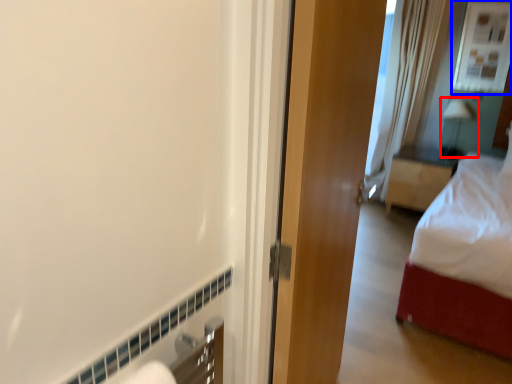
Question: Which of the following is the farthest to the observer, lamp (highlighted by a red box) or window (highlighted by a blue box)?

Choices:
 (A) lamp
 (B) window

Answer: (A)